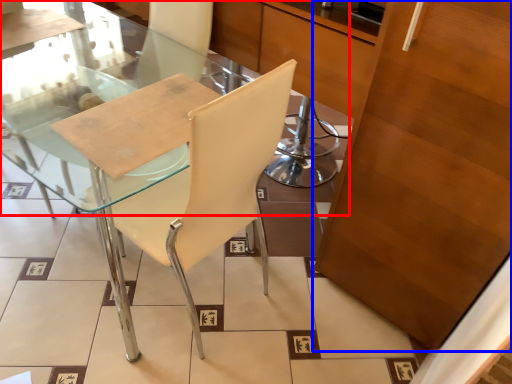
Question: Which object appears farthest to the camera in this image, glass table (highlighted by a red box) or cabinetry (highlighted by a blue box)?

Choices:
 (A) glass table
 (B) cabinetry

Answer: (A)